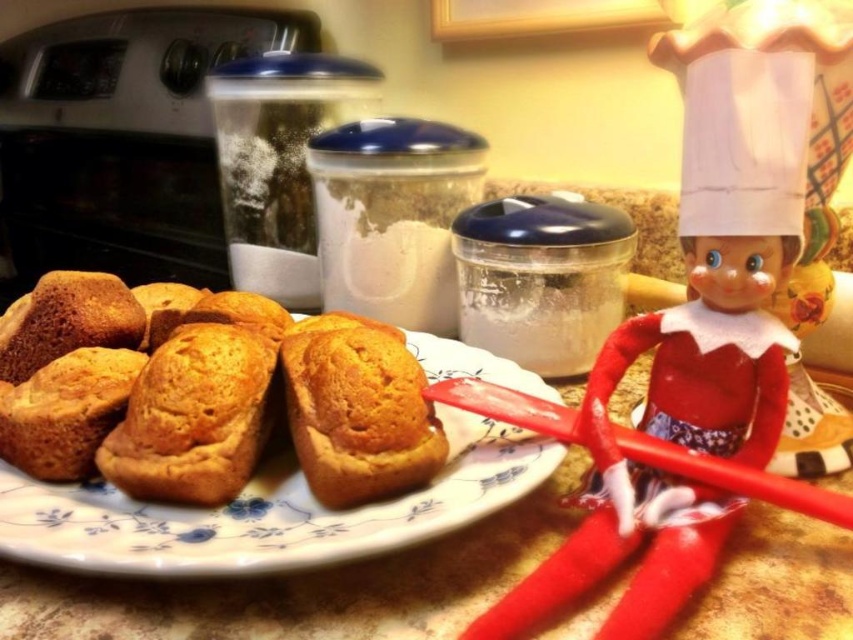
Question: Can you confirm if golden-brown ceramic muffins at center-left is thinner than golden matte muffin at center?

Choices:
 (A) yes
 (B) no

Answer: (B)

Question: In this image, where is golden-brown ceramic muffins at center-left located relative to golden matte muffin at center?

Choices:
 (A) below
 (B) above

Answer: (A)

Question: Which of the following is the closest to the observer?

Choices:
 (A) coord(335,339)
 (B) coord(193,573)

Answer: (B)

Question: Does golden-brown ceramic muffins at center-left have a lesser width compared to golden matte muffin at center?

Choices:
 (A) yes
 (B) no

Answer: (B)